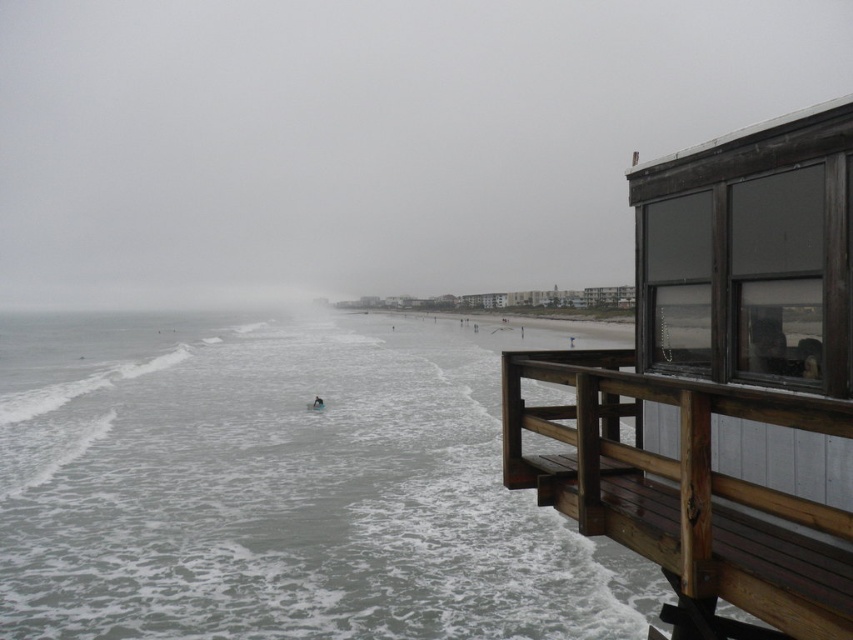
Can you confirm if transparent glass window at upper right is taller than brown wooden bench at right?

Yes, transparent glass window at upper right is taller than brown wooden bench at right.

Locate an element on the screen. This screenshot has width=853, height=640. transparent glass window at upper right is located at coordinates (364, 138).

Looking at this image, which is more to the right, transparent glass window at upper right or blue wetsuit surfer at center?

From the viewer's perspective, transparent glass window at upper right appears more on the right side.

At what (x,y) coordinates should I click in order to perform the action: click on transparent glass window at upper right. Please return your answer as a coordinate pair (x, y). The image size is (853, 640). Looking at the image, I should click on (364, 138).

Locate an element on the screen. This screenshot has height=640, width=853. transparent glass window at upper right is located at coordinates (364, 138).

Who is positioned more to the left, gray matte water at lower left or brown wooden bench at right?

From the viewer's perspective, gray matte water at lower left appears more on the left side.

Which is above, gray matte water at lower left or brown wooden bench at right?

Positioned higher is brown wooden bench at right.

Who is more forward, (244, 483) or (601, 387)?

Point (601, 387) is more forward.

Find the location of `gray matte water at lower left`. gray matte water at lower left is located at coordinates (279, 486).